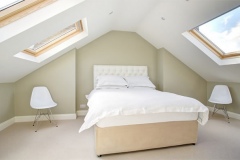
At what (x,y) coordinates should I click in order to perform the action: click on chair. Please return your answer as a coordinate pair (x, y). The width and height of the screenshot is (240, 160). Looking at the image, I should click on (44, 102), (231, 97).